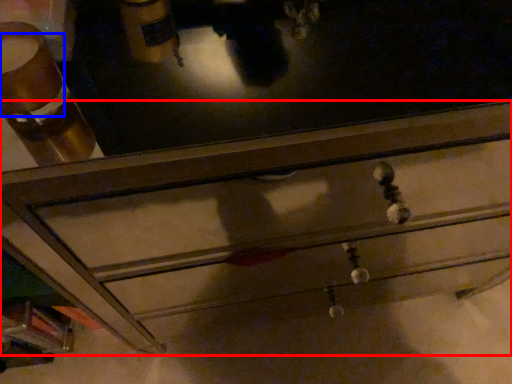
Question: Which point is further to the camera, chest of drawers (highlighted by a red box) or beverage (highlighted by a blue box)?

Choices:
 (A) chest of drawers
 (B) beverage

Answer: (A)